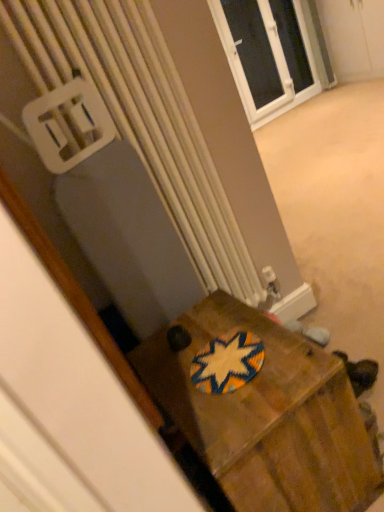
Question: Is there a large distance between wooden box at center and white plastic window at upper center?

Choices:
 (A) no
 (B) yes

Answer: (B)

Question: From the image's perspective, does wooden box at center appear lower than white plastic window at upper center?

Choices:
 (A) yes
 (B) no

Answer: (A)

Question: Is wooden box at center oriented away from white plastic window at upper center?

Choices:
 (A) yes
 (B) no

Answer: (B)

Question: Is white plastic window at upper center completely or partially inside wooden box at center?

Choices:
 (A) yes
 (B) no

Answer: (B)

Question: Is wooden box at center located outside white plastic window at upper center?

Choices:
 (A) no
 (B) yes

Answer: (B)

Question: Is wooden box at center touching white plastic window at upper center?

Choices:
 (A) yes
 (B) no

Answer: (B)

Question: From a real-world perspective, is woven fabric coaster at center over wooden box at center?

Choices:
 (A) yes
 (B) no

Answer: (A)

Question: Considering the relative positions of woven fabric coaster at center and wooden box at center in the image provided, is woven fabric coaster at center in front of wooden box at center?

Choices:
 (A) no
 (B) yes

Answer: (A)

Question: From a real-world perspective, is woven fabric coaster at center under wooden box at center?

Choices:
 (A) no
 (B) yes

Answer: (A)

Question: Can you confirm if woven fabric coaster at center is taller than wooden box at center?

Choices:
 (A) no
 (B) yes

Answer: (A)

Question: Does woven fabric coaster at center have a lesser height compared to wooden box at center?

Choices:
 (A) yes
 (B) no

Answer: (A)

Question: Is woven fabric coaster at center turned away from wooden box at center?

Choices:
 (A) yes
 (B) no

Answer: (A)

Question: Is white plastic window at upper center at the back of white plastic radiator at center?

Choices:
 (A) yes
 (B) no

Answer: (B)